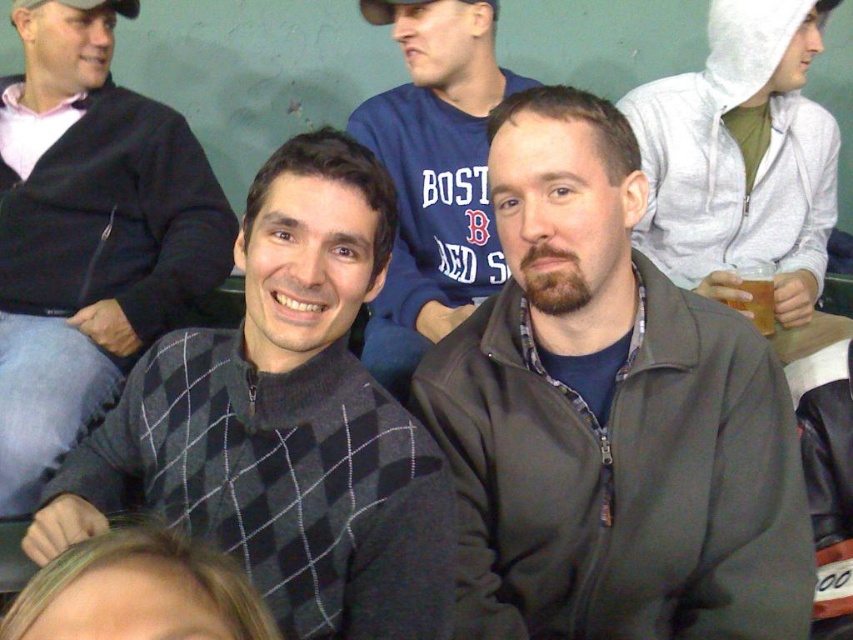
Question: In this image, where is white zip-up hoodie at upper right located relative to dark gray sweater at center?

Choices:
 (A) left
 (B) right

Answer: (B)

Question: Which object is closer to the camera taking this photo?

Choices:
 (A) dark gray argyle sweater at center
 (B) dark gray zip-up jacket at center

Answer: (A)

Question: Which point is farther to the camera?

Choices:
 (A) white zip-up hoodie at upper right
 (B) dark gray zip-up jacket at center
 (C) dark gray argyle sweater at center

Answer: (A)

Question: Is dark gray argyle sweater at center further to camera compared to white zip-up hoodie at upper right?

Choices:
 (A) no
 (B) yes

Answer: (A)

Question: Which point is farther to the camera?

Choices:
 (A) (345, 244)
 (B) (640, 145)

Answer: (B)

Question: From the image, what is the correct spatial relationship of dark gray argyle sweater at left in relation to dark gray sweater at center?

Choices:
 (A) above
 (B) below

Answer: (B)